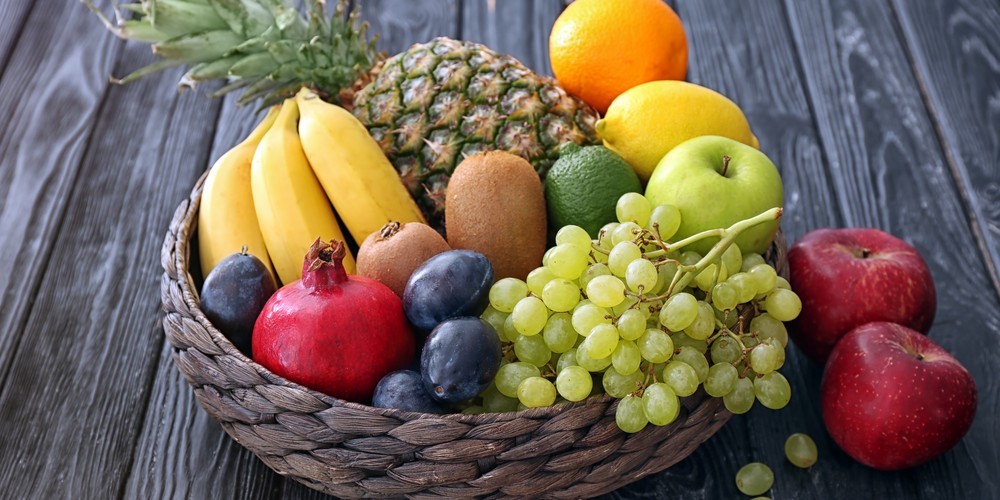
Where is `boards in table`? This screenshot has width=1000, height=500. boards in table is located at coordinates (9, 18), (45, 85), (132, 166), (229, 133), (411, 36), (502, 34), (570, 5), (756, 73), (884, 126), (953, 75).